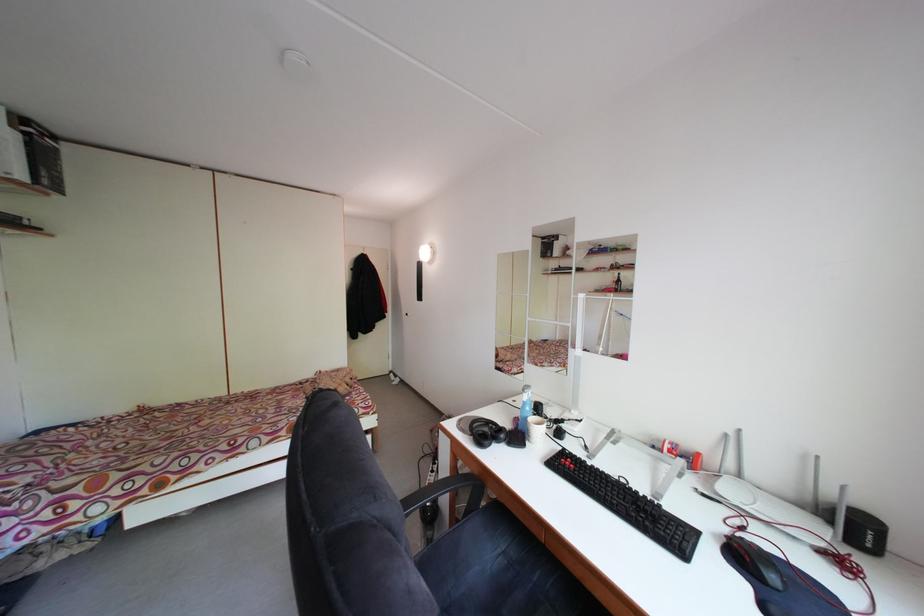
Identify the location of white mug. (536, 429).